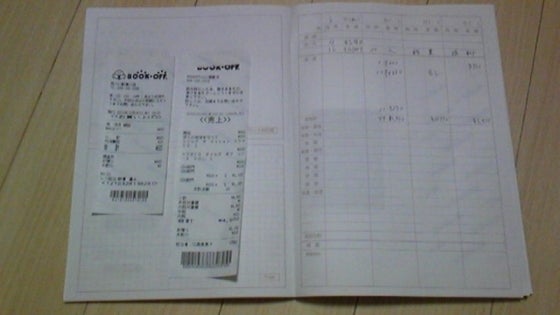
Where is `columns`? columns is located at coordinates (312, 85), (347, 85), (398, 86), (424, 90), (465, 91).